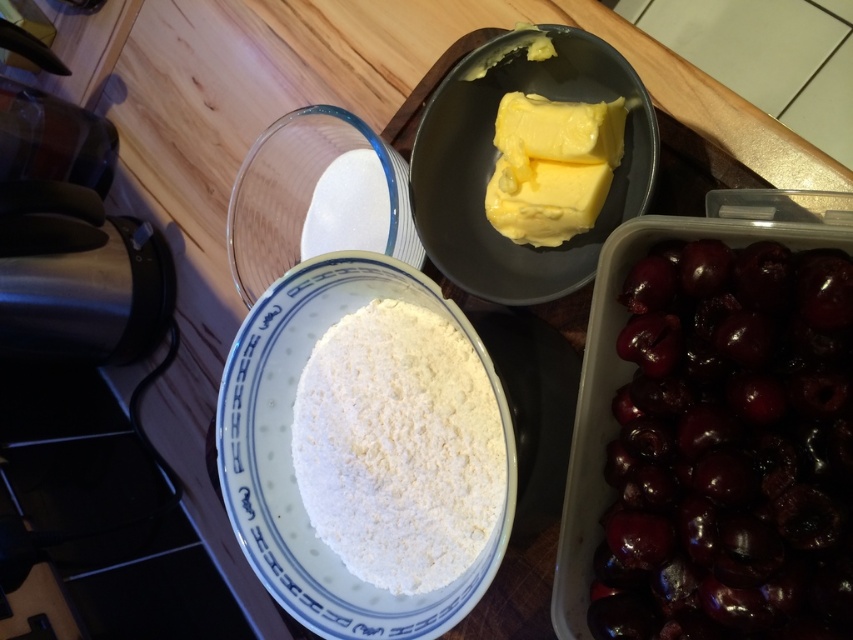
Which is behind, point (699, 541) or point (553, 228)?

Positioned behind is point (553, 228).

Does point (817, 253) lie behind point (538, 196)?

No.

Locate an element on the screen. shiny dark red cherries at bottom right is located at coordinates (730, 449).

Describe the element at coordinates (730, 449) in the screenshot. I see `shiny dark red cherries at bottom right` at that location.

Between shiny dark red cherries at bottom right and white powdery flour at center, which one has less height?

white powdery flour at center is shorter.

Locate an element on the screen. Image resolution: width=853 pixels, height=640 pixels. shiny dark red cherries at bottom right is located at coordinates (730, 449).

Who is lower down, shiny dark red cherries at bottom right or yellowish matte butter at upper center?

shiny dark red cherries at bottom right is below.

Who is positioned more to the right, shiny dark red cherries at bottom right or yellowish matte butter at upper center?

shiny dark red cherries at bottom right

At what (x,y) coordinates should I click in order to perform the action: click on shiny dark red cherries at bottom right. Please return your answer as a coordinate pair (x, y). Looking at the image, I should click on (730, 449).

The height and width of the screenshot is (640, 853). In order to click on shiny dark red cherries at bottom right in this screenshot , I will do `click(730, 449)`.